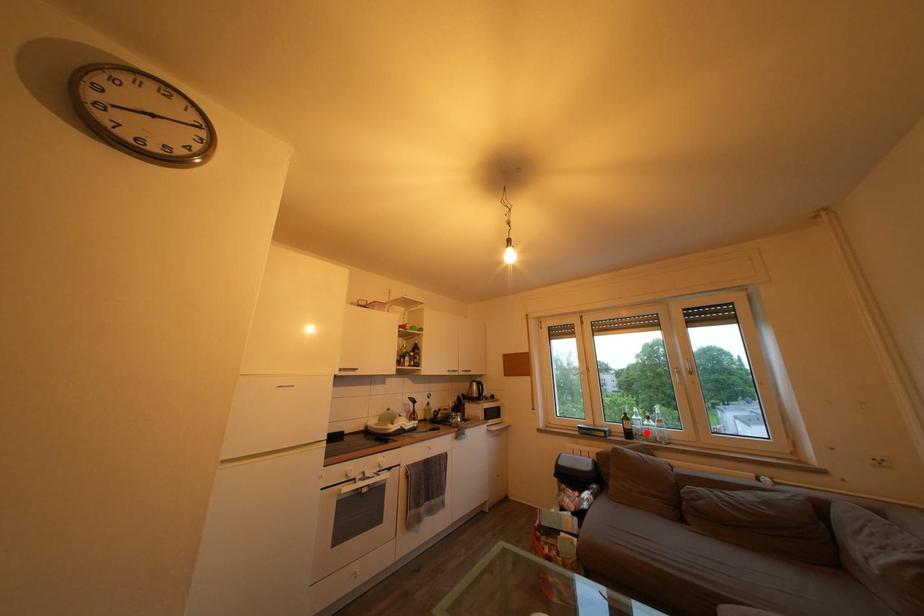
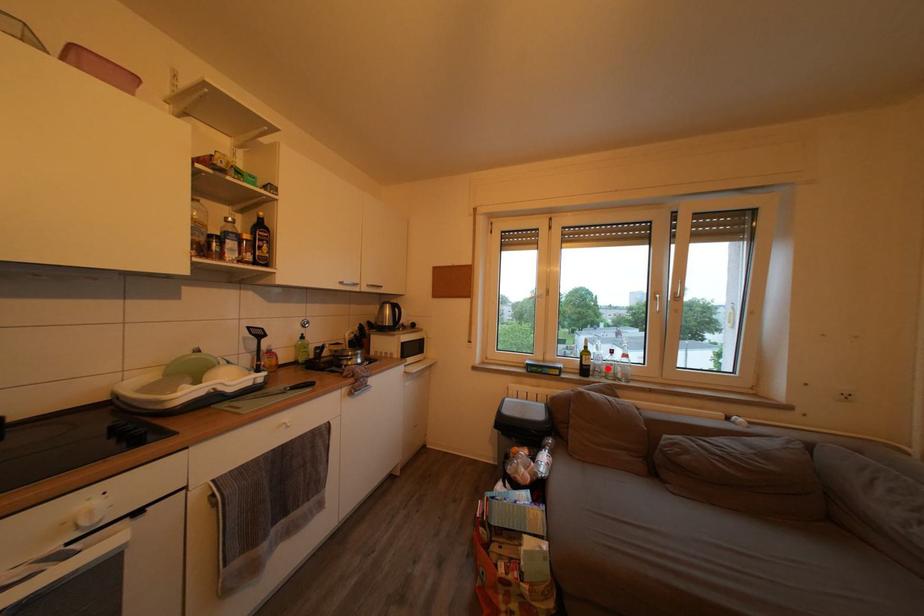
I am providing you with two images of the same scene from different viewpoints. A red point is marked on the first image and another point is marked on the second image. Does the point marked in image1 correspond to the same location as the one in image2?

Yes